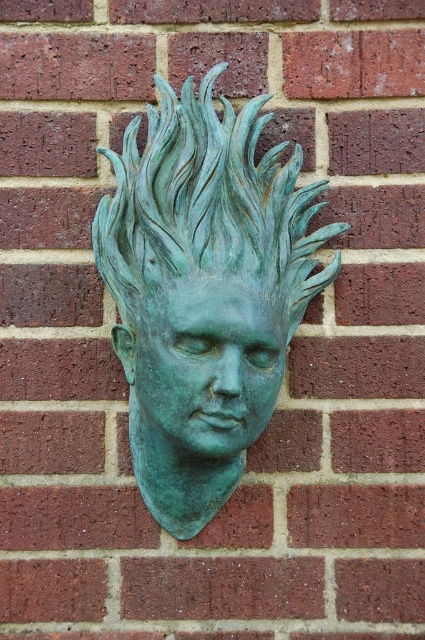
Can you confirm if green patina bust at center is shorter than green patina face at center?

Incorrect, green patina bust at center's height does not fall short of green patina face at center's.

Is point (141, 490) less distant than point (224, 396)?

No, (141, 490) is behind (224, 396).

What are the coordinates of `green patina bust at center` in the screenshot? It's located at (204, 291).